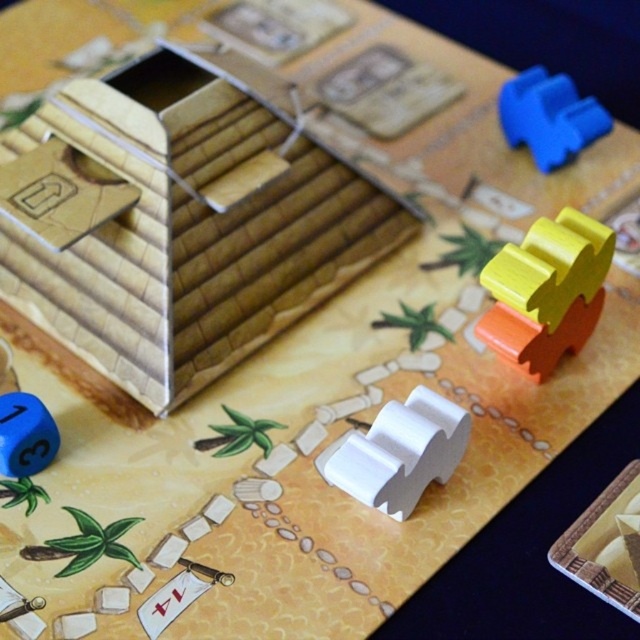
You are playing a board game and need to place a new piece between the yellow matte wooden piece at upper right and the blue rubber block at upper right. The new piece is 10 inches long. Can it fit between them without overlapping either piece?

The yellow matte wooden piece at upper right and blue rubber block at upper right are 15.73 inches apart from each other. Since the new piece is 10 inches long, which is shorter than the distance between them, it can fit between them without overlapping either piece.

You are playing a board game and need to place a new piece between the wooden pyramid at center and the yellow matte wooden piece at upper right. Can you fit it vertically between them?

The wooden pyramid at center is located above the yellow matte wooden piece at upper right, so there is no vertical space between them to fit a new piece.